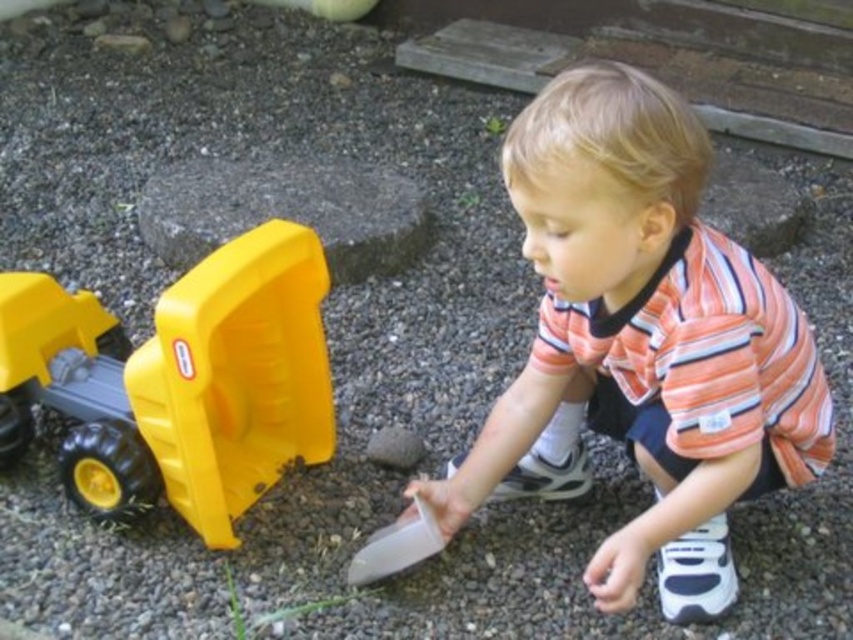
Who is taller, orange striped shirt at center or yellow plastic toy truck at left?

With more height is orange striped shirt at center.

Looking at this image, is orange striped shirt at center taller than yellow plastic toy truck at left?

Yes.

The width and height of the screenshot is (853, 640). Describe the element at coordinates (642, 342) in the screenshot. I see `orange striped shirt at center` at that location.

Where is `orange striped shirt at center`? This screenshot has height=640, width=853. orange striped shirt at center is located at coordinates (642, 342).